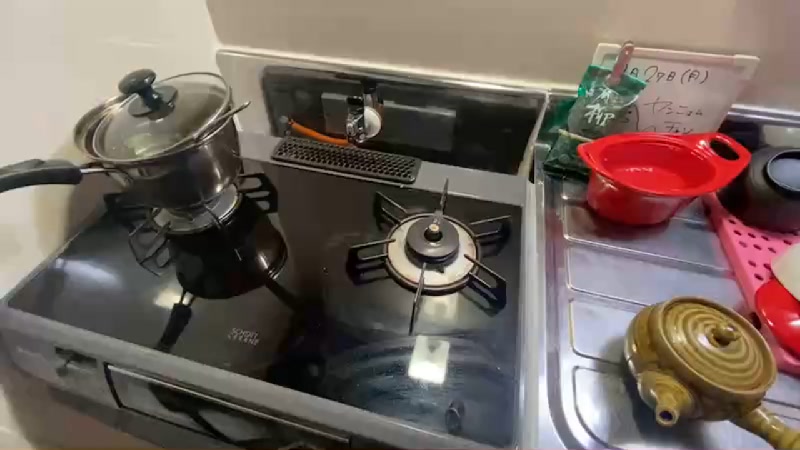
Where is `silver utensil sticking out of sauce pan on burner`? The width and height of the screenshot is (800, 450). silver utensil sticking out of sauce pan on burner is located at coordinates (240, 110).